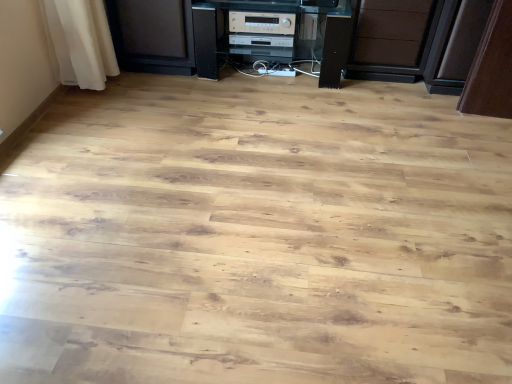
Image resolution: width=512 pixels, height=384 pixels. Find the location of `vacant area that is in front of brown matte drawer at center`. vacant area that is in front of brown matte drawer at center is located at coordinates (388, 100).